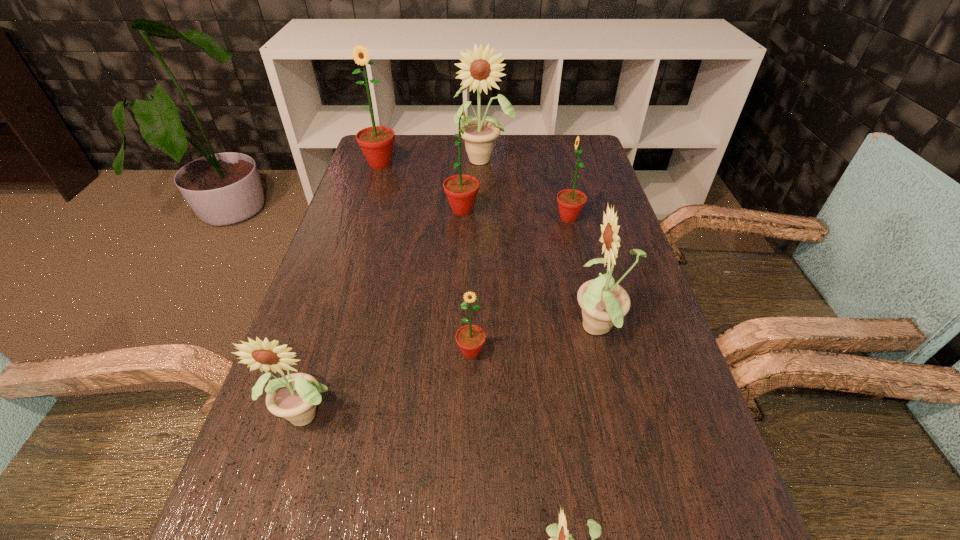
Find the location of a particular element. The width and height of the screenshot is (960, 540). free space between the smallest green sunflower and the biggest green sunflower is located at coordinates (425, 258).

At what (x,y) coordinates should I click in order to perform the action: click on vacant region between the smallest green sunflower and the rightmost green sunflower. Please return your answer as a coordinate pair (x, y). This screenshot has width=960, height=540. Looking at the image, I should click on (519, 285).

Image resolution: width=960 pixels, height=540 pixels. Identify the location of free space between the rightmost green sunflower and the farthest yellow sunflower. (526, 188).

Find the location of a particular element. free space between the second farthest yellow sunflower and the second biggest green sunflower is located at coordinates (531, 270).

This screenshot has width=960, height=540. I want to click on vacant area between the biggest yellow sunflower and the second smallest green sunflower, so click(x=526, y=188).

This screenshot has width=960, height=540. In order to click on vacant region between the rightmost green sunflower and the rightmost yellow sunflower in this screenshot , I will do `click(585, 274)`.

This screenshot has width=960, height=540. Identify the location of object that can be found as the closest to the third smallest green sunflower. [479, 136].

Identify which object is the fourth closest to the farthest green sunflower. Please provide its 2D coordinates. Your answer should be formatted as a tuple, i.e. [(x, y)], where the tuple contains the x and y coordinates of a point satisfying the conditions above.

[(470, 338)]

You are a GUI agent. You are given a task and a screenshot of the screen. Output one action in this format:
    pyautogui.click(x=<x>, y=<y>)
    Task: Click on the sunflower object that ranks as the fifth closest to the biggest green sunflower
    
    Given the screenshot: What is the action you would take?
    pyautogui.click(x=604, y=303)

Where is `sunflower object that ranks as the seventh closest to the second biggest green sunflower`? sunflower object that ranks as the seventh closest to the second biggest green sunflower is located at coordinates (562, 539).